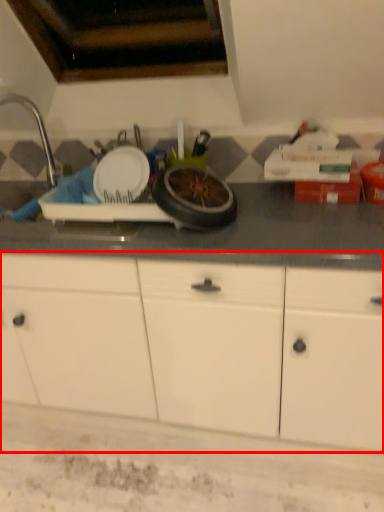
Question: From the image's perspective, where is cabinetry (annotated by the red box) located in relation to faucet in the image?

Choices:
 (A) below
 (B) above

Answer: (A)